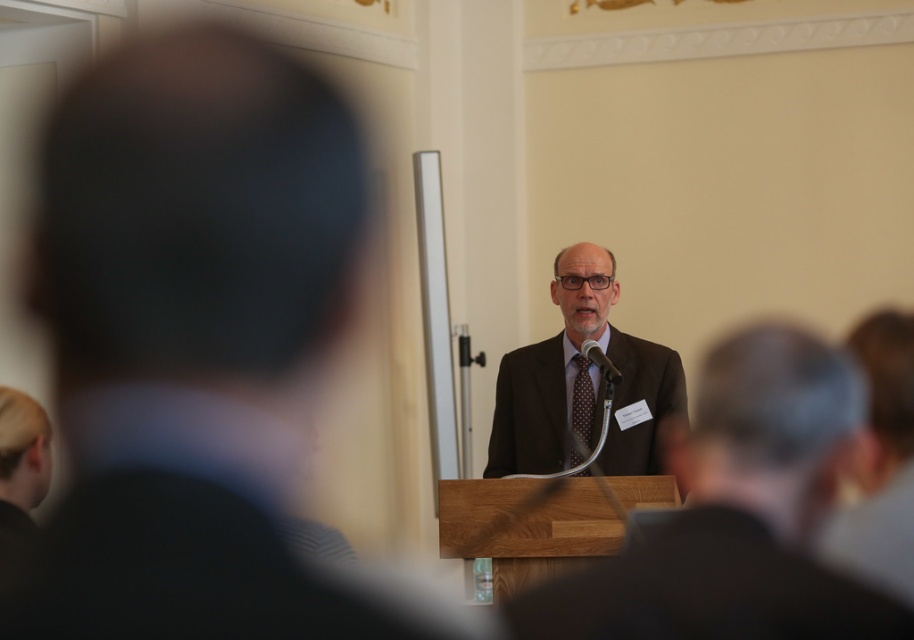
Question: Which point appears farthest from the camera in this image?

Choices:
 (A) (572, 380)
 (B) (771, 538)
 (C) (539, 596)
 (D) (575, 388)

Answer: (A)

Question: Which object is the closest to the matte brown suit at center?

Choices:
 (A) brown textured suit at center
 (B) brown dotted fabric tie at center
 (C) brown suit at center
 (D) dark brown fabric business suit at center

Answer: (D)

Question: Is brown textured suit at center smaller than brown dotted fabric tie at center?

Choices:
 (A) yes
 (B) no

Answer: (B)

Question: Among these objects, which one is nearest to the camera?

Choices:
 (A) brown textured suit at center
 (B) dark brown fabric business suit at center
 (C) brown suit at center

Answer: (C)

Question: Is brown suit at center to the left of matte brown suit at center from the viewer's perspective?

Choices:
 (A) no
 (B) yes

Answer: (B)

Question: Where is matte brown suit at center located in relation to dark brown fabric business suit at center in the image?

Choices:
 (A) right
 (B) left

Answer: (A)